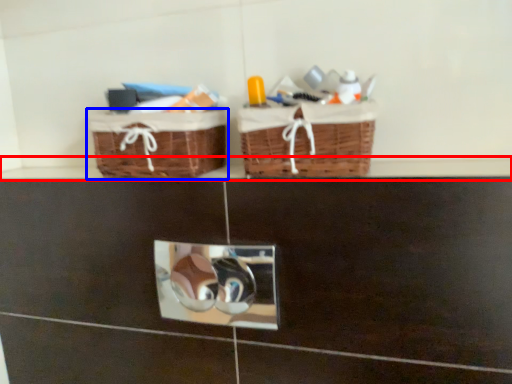
Question: Among these objects, which one is nearest to the camera, ledge (highlighted by a red box) or picnic basket (highlighted by a blue box)?

Choices:
 (A) ledge
 (B) picnic basket

Answer: (A)